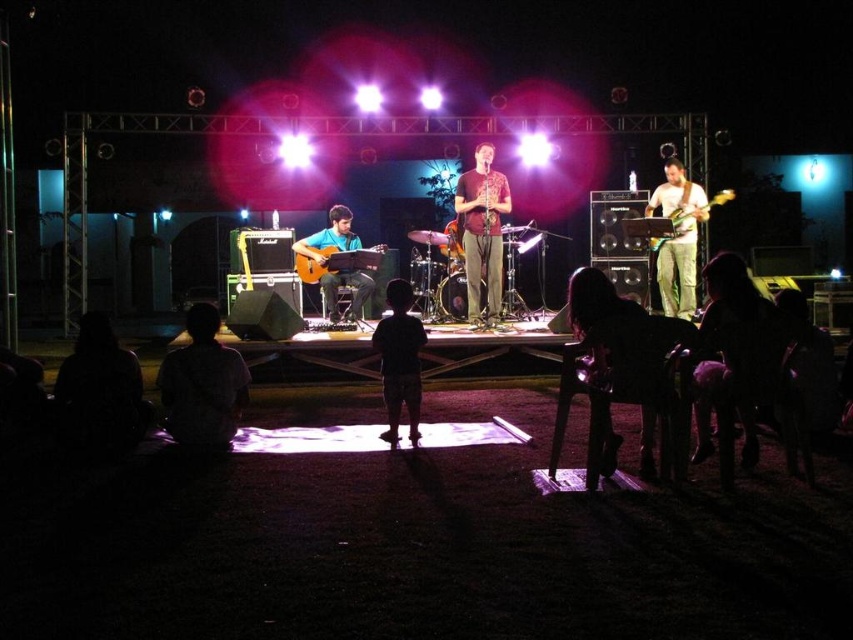
You are a photographer at the nighttime concert. You want to capture a photo that includes both the lead singer and the drummer. The lead singer is standing at point (x=399, y=280), and the drummer is seated at point (x=495, y=209). Since you want the drummer to be in focus, which of the two points should you focus on?

You should focus on point (x=495, y=209) where the drummer is seated because it is closer to the viewer than point (x=399, y=280) where the lead singer is standing. Focusing on the closer point ensures the drummer will be in focus.

What are the coordinates of the dark matte shirt at center?

The dark matte shirt at center is located at point (399, 358).